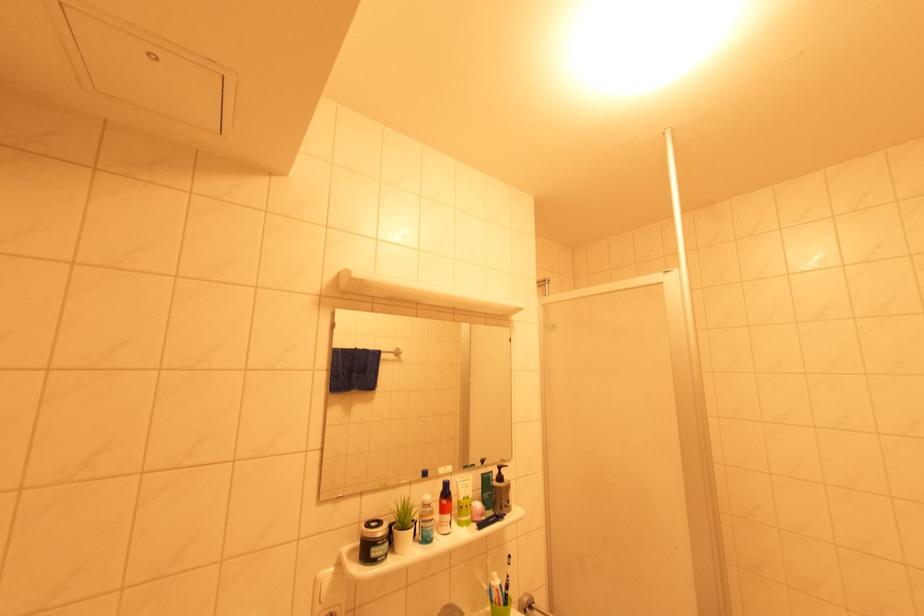
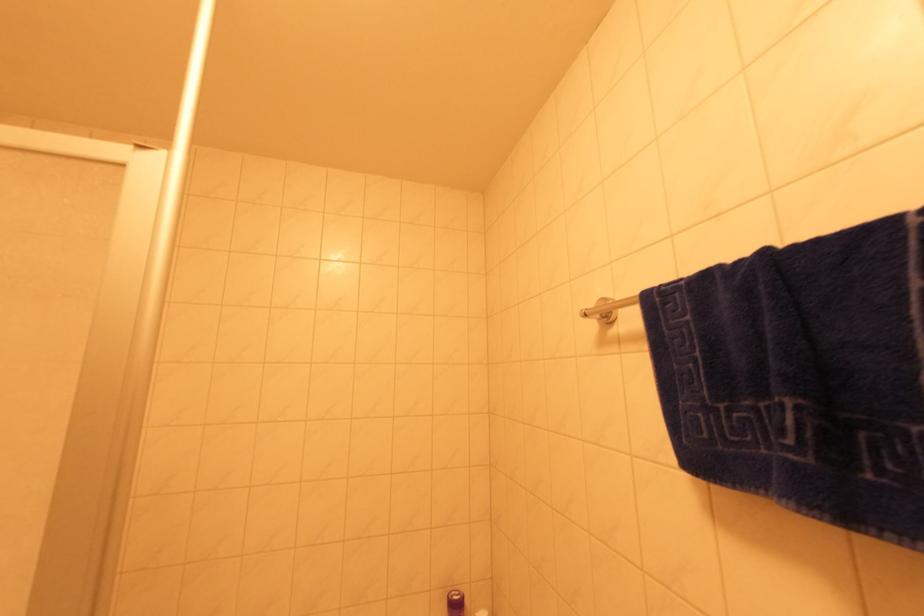
Question: How did the camera likely rotate?

Choices:
 (A) Left
 (B) Right
 (C) Up
 (D) Down

Answer: (B)